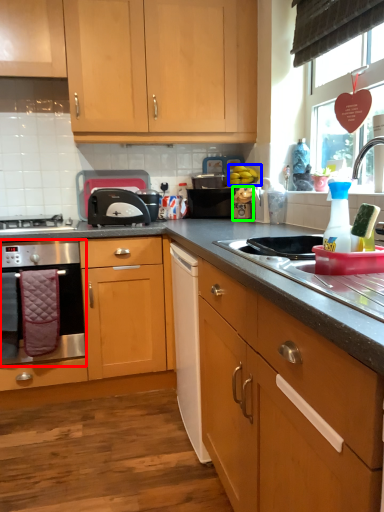
Question: Based on their relative distances, which object is nearer to home appliance (highlighted by a red box)? Choose from fruit (highlighted by a blue box) and appliance (highlighted by a green box).

Choices:
 (A) fruit
 (B) appliance

Answer: (B)